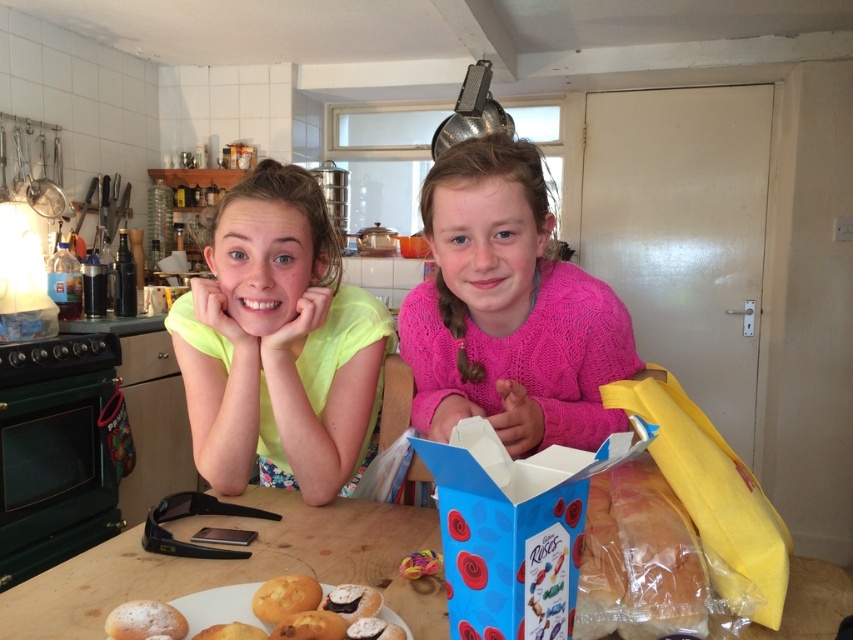
You are helping organize items on a kitchen table. You need to place a blue cardboard box at center and a golden brown bread at lower left. According to the scene, which item is located to the right of the other?

The blue cardboard box at center is positioned on the right side of golden brown bread at lower left.

You are a photographer standing in the kitchen scene. You want to take a closeup shot of the wooden table at center. The camera you are using has a minimum focusing distance of 24 inches. Will you be able to move closer to the table to take the photo?

The wooden table at center is 26.27 inches away from the camera. Since the minimum focusing distance of your camera is 24 inches, you can move closer to the table to take the photo as you are currently 2.27 inches away from the minimum required distance.

You are taking a photo of the two points in the kitchen scene. Which point, point (96, 605) or point (238, 592), will appear larger in your photo?

Point (96, 605) is closer to the camera than point (238, 592), so it will appear larger in the photo.